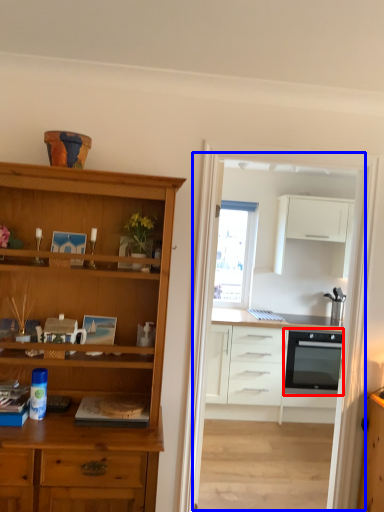
Question: Which object appears closest to the camera in this image, oven (highlighted by a red box) or entertainment center (highlighted by a blue box)?

Choices:
 (A) oven
 (B) entertainment center

Answer: (B)